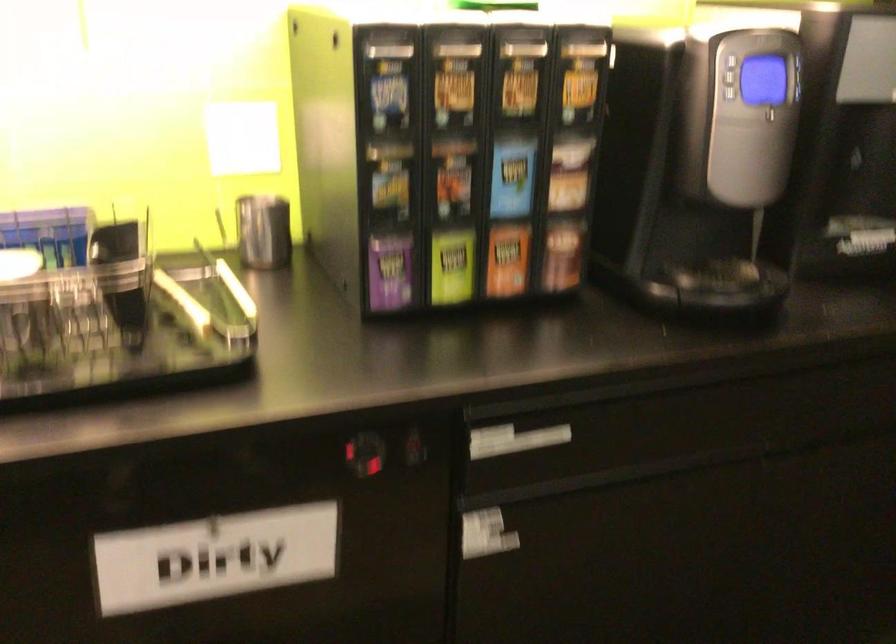
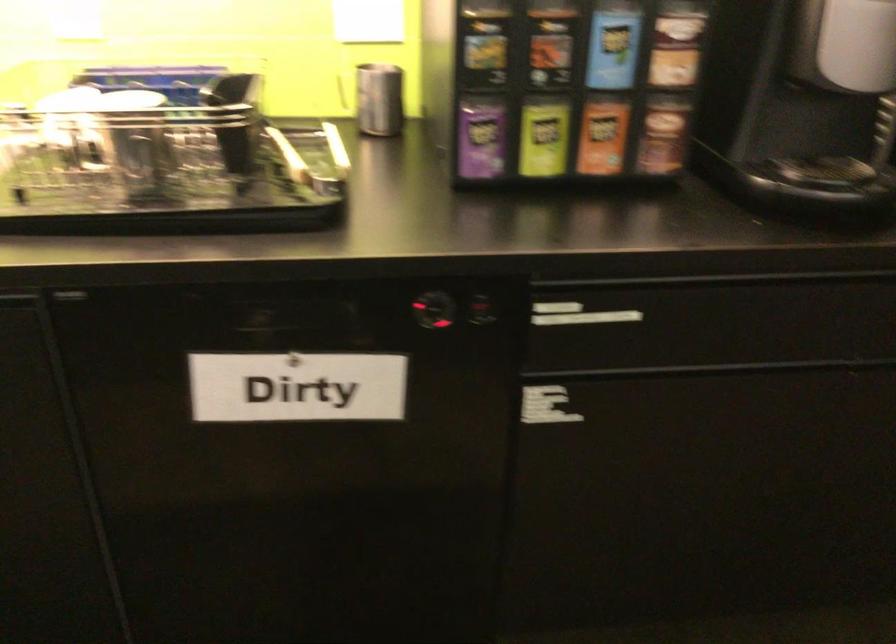
Find the pixel in the second image that matches point (451, 263) in the first image.

(543, 138)